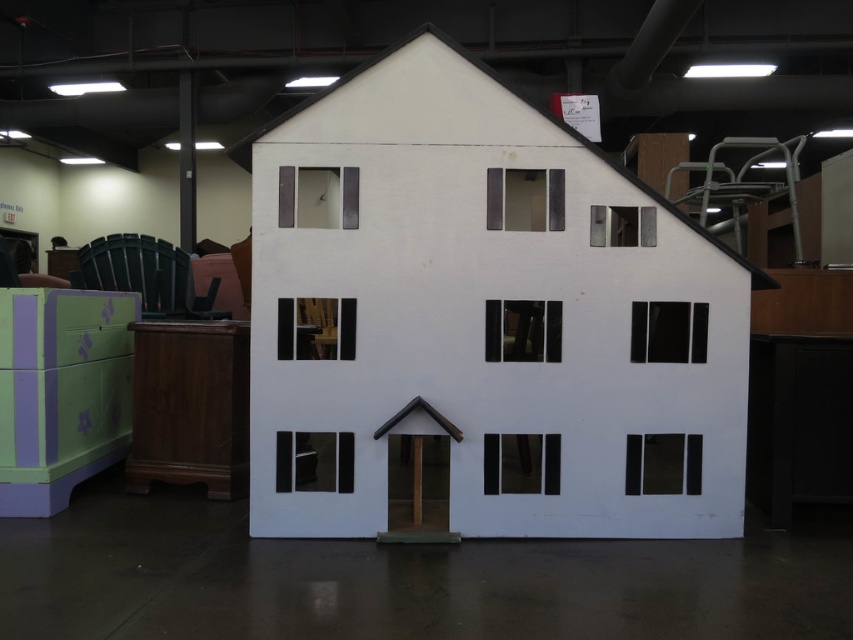
You are a delivery person who needs to deliver a package to the matte brown door at center. The white matte house at center is in your way. Can you walk around it to reach the door?

The white matte house at center is larger in size than the matte brown door at center, so you can walk around the white matte house at center to reach the matte brown door at center.